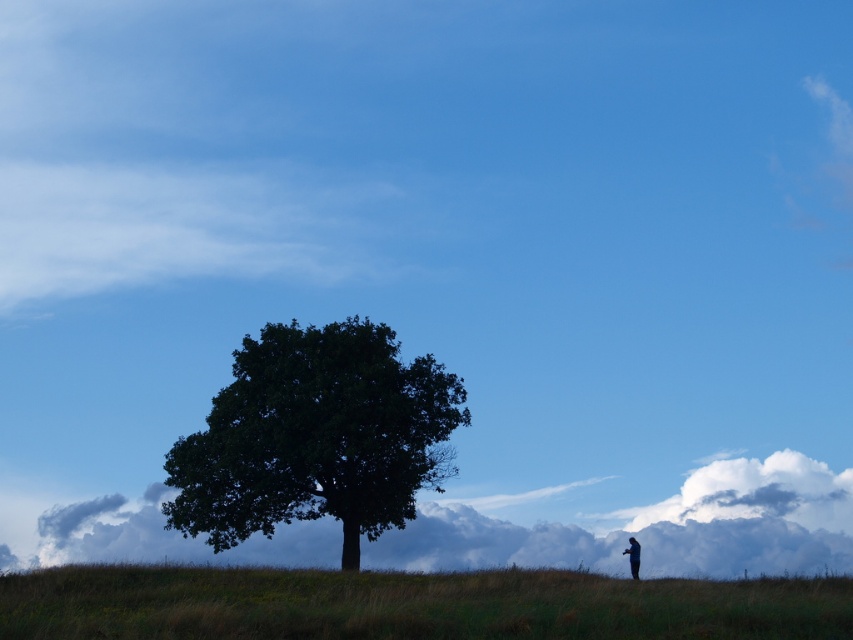
Is green grassy hillside at lower center further to the viewer compared to green leafy tree at center?

That is False.

Where is `green grassy hillside at lower center`? The height and width of the screenshot is (640, 853). green grassy hillside at lower center is located at coordinates (410, 604).

Can you confirm if green leafy tree at center is thinner than blue fabric person at lower right?

Yes, green leafy tree at center is thinner than blue fabric person at lower right.

Is green leafy tree at center positioned before blue fabric person at lower right?

No, green leafy tree at center is further to the viewer.

Is point (399, 464) in front of point (633, 573)?

That is False.

Find the location of `green leafy tree at center`. green leafy tree at center is located at coordinates (316, 436).

Which is more to the right, green grassy hillside at lower center or blue fabric person at lower right?

blue fabric person at lower right is more to the right.

Is point (202, 577) behind point (637, 557)?

No, (202, 577) is in front of (637, 557).

At what (x,y) coordinates should I click in order to perform the action: click on green grassy hillside at lower center. Please return your answer as a coordinate pair (x, y). The image size is (853, 640). Looking at the image, I should click on (410, 604).